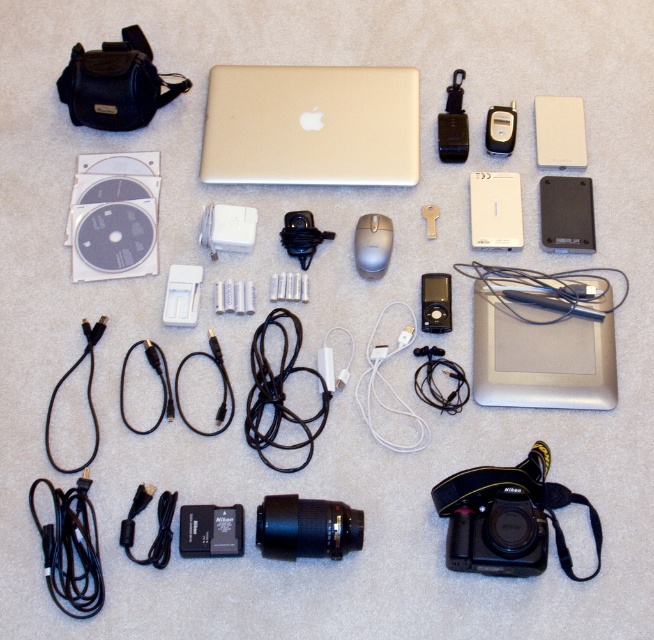
You are packing for a trip and have a small bag that can only fit items shorter than the silver metallic mouse at center. Can you place the black plastic hard drive at upper right into the bag?

The black plastic hard drive at upper right is taller than the silver metallic mouse at center. Since the bag requires items to be shorter than the mouse, the hard drive cannot fit into the bag.

You are packing a box that can only fit items smaller than the satin black ipod at center. Based on the scene, can the black plastic hard drive at upper right be placed in the box?

The black plastic hard drive at upper right is bigger than the satin black ipod at center, so it cannot be placed in the box designed for items smaller than the satin black ipod at center.

You are packing a box and need to place the black plastic lens at center and the white plastic ipod at upper right. Which one should you place first to ensure proper stacking?

The black plastic lens at center is shorter than the white plastic ipod at upper right, so you should place the white plastic ipod at upper right first to ensure proper stacking.